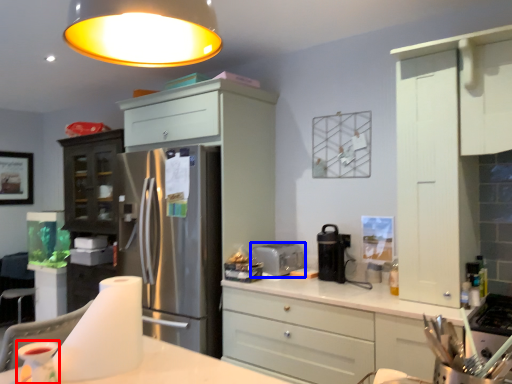
Question: Which object is further to the camera taking this photo, appliance (highlighted by a red box) or toaster (highlighted by a blue box)?

Choices:
 (A) appliance
 (B) toaster

Answer: (B)